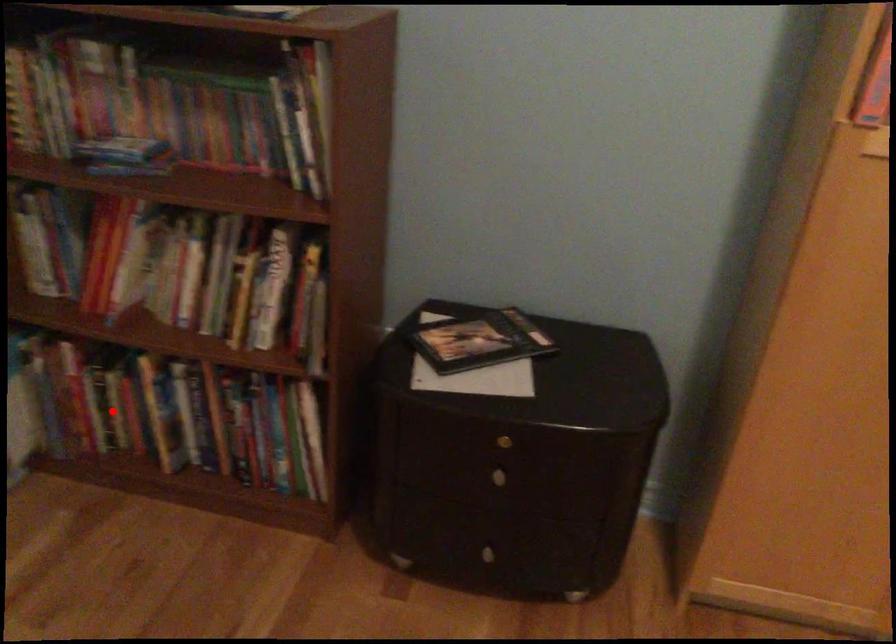
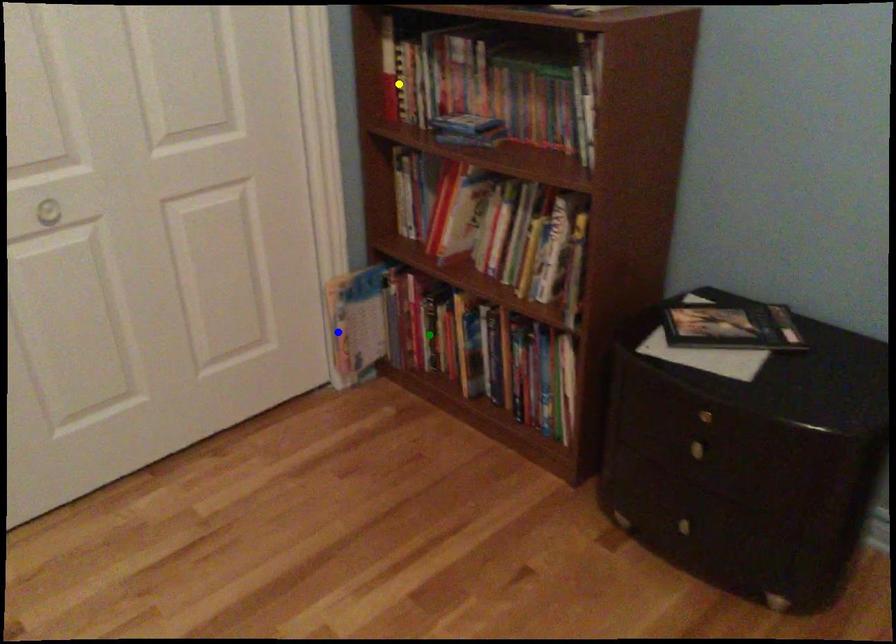
Question: I am providing you with two images of the same scene from different viewpoints. A red point is marked on the first image. You are given multiple points on the second image. Can you choose the point in image 2 that corresponds to the point in image 1?

Choices:
 (A) yellow point
 (B) blue point
 (C) green point

Answer: (C)